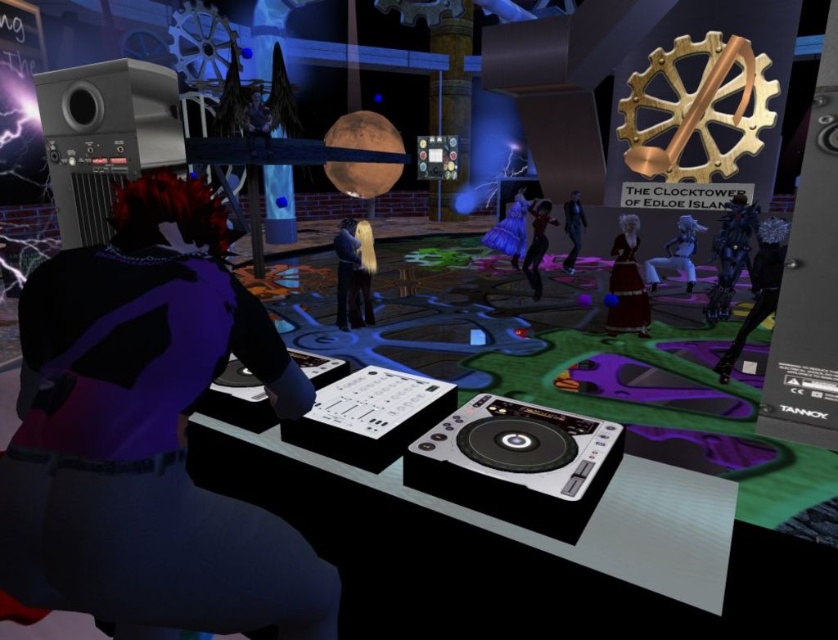
Does smooth black hair at center have a lesser width compared to shiny blue dress at center?

Indeed, smooth black hair at center has a lesser width compared to shiny blue dress at center.

Can you confirm if smooth black hair at center is positioned below shiny blue dress at center?

Yes, smooth black hair at center is below shiny blue dress at center.

What do you see at coordinates (345, 269) in the screenshot?
I see `smooth black hair at center` at bounding box center [345, 269].

You are a GUI agent. You are given a task and a screenshot of the screen. Output one action in this format:
    pyautogui.click(x=<x>, y=<y>)
    Task: Click on the smooth black hair at center
    This screenshot has height=640, width=838.
    Given the screenshot: What is the action you would take?
    pyautogui.click(x=345, y=269)

Can you confirm if smooth black hair at center is positioned below shiny black suit at center?

Indeed, smooth black hair at center is positioned under shiny black suit at center.

Which of these two, smooth black hair at center or shiny black suit at center, stands shorter?

smooth black hair at center

Does point (348, 236) come closer to viewer compared to point (570, 253)?

Yes, it is in front of point (570, 253).

This screenshot has height=640, width=838. I want to click on smooth black hair at center, so click(x=345, y=269).

Can you confirm if matte black dress at center is thinner than blonde hair at center?

No, matte black dress at center is not thinner than blonde hair at center.

Can you confirm if matte black dress at center is shorter than blonde hair at center?

Correct, matte black dress at center is not as tall as blonde hair at center.

The image size is (838, 640). In order to click on matte black dress at center in this screenshot , I will do `click(676, 253)`.

Image resolution: width=838 pixels, height=640 pixels. Identify the location of matte black dress at center. (676, 253).